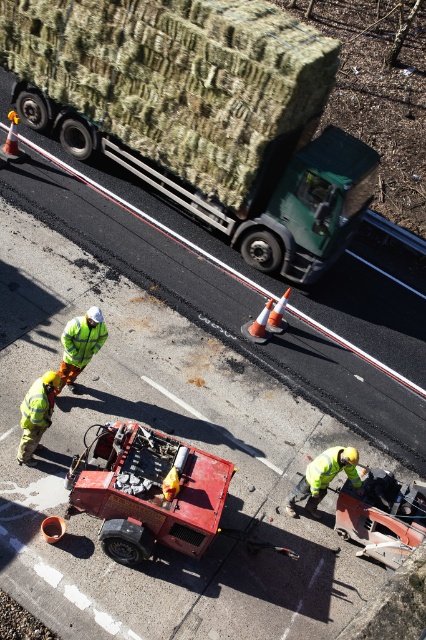
Question: Which object is the farthest from the reflective yellow safety vest at lower left?

Choices:
 (A) high visibility yellow jacket at lower right
 (B) green camouflage trailer truck at upper left
 (C) green reflective safety vest at lower left
 (D) high visibility reflective jacket at center

Answer: (B)

Question: Can you confirm if green camouflage trailer truck at upper left is positioned above reflective yellow safety vest at lower left?

Choices:
 (A) yes
 (B) no

Answer: (A)

Question: Is high visibility reflective jacket at center closer to the viewer compared to reflective yellow safety vest at lower left?

Choices:
 (A) no
 (B) yes

Answer: (A)

Question: Which point is farther to the camera?

Choices:
 (A) high visibility reflective jacket at center
 (B) green reflective safety vest at lower left
 (C) green camouflage trailer truck at upper left

Answer: (C)

Question: Estimate the real-world distances between objects in this image. Which object is closer to the green camouflage trailer truck at upper left?

Choices:
 (A) high visibility reflective jacket at center
 (B) reflective yellow safety vest at lower left
 (C) green reflective safety vest at lower left

Answer: (A)

Question: Is high visibility reflective jacket at center to the right of green reflective safety vest at lower left from the viewer's perspective?

Choices:
 (A) yes
 (B) no

Answer: (B)